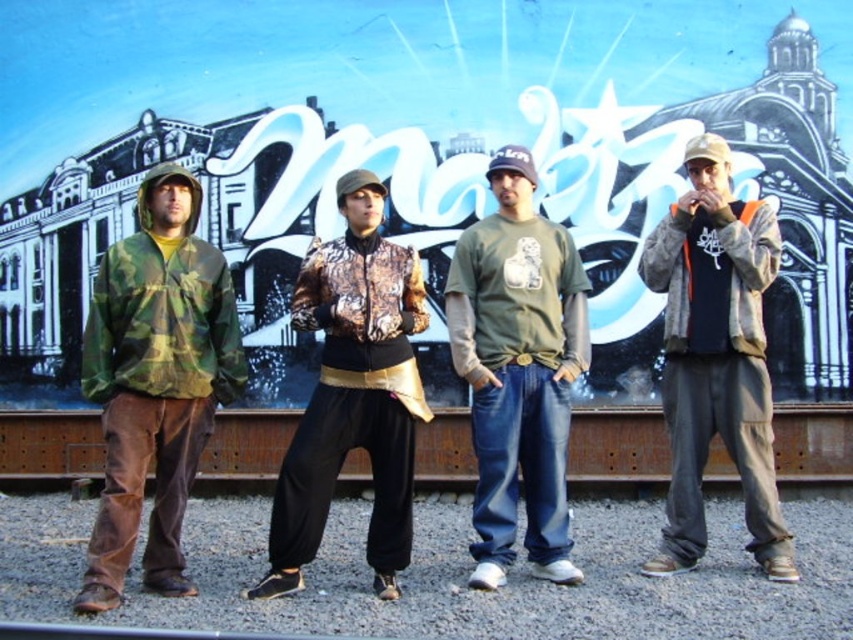
Question: Is camouflage fabric jacket at left above olive green t-shirt at center?

Choices:
 (A) yes
 (B) no

Answer: (B)

Question: Observing the image, what is the correct spatial positioning of camouflage fabric jacket at left in reference to dark gray cotton jacket at right?

Choices:
 (A) below
 (B) above

Answer: (A)

Question: Can you confirm if olive green t-shirt at center is wider than metallic patterned jacket at center?

Choices:
 (A) yes
 (B) no

Answer: (B)

Question: Which point is farther to the camera?

Choices:
 (A) (666, 353)
 (B) (125, 378)
 (C) (457, 300)
 (D) (375, 428)

Answer: (A)

Question: Among these objects, which one is farthest from the camera?

Choices:
 (A) camouflage fabric jacket at left
 (B) olive green t-shirt at center
 (C) metallic patterned jacket at center
 (D) dark gray cotton jacket at right

Answer: (D)

Question: Which is farther from the olive green t-shirt at center?

Choices:
 (A) dark gray cotton jacket at right
 (B) metallic patterned jacket at center
 (C) camouflage fabric jacket at left

Answer: (C)